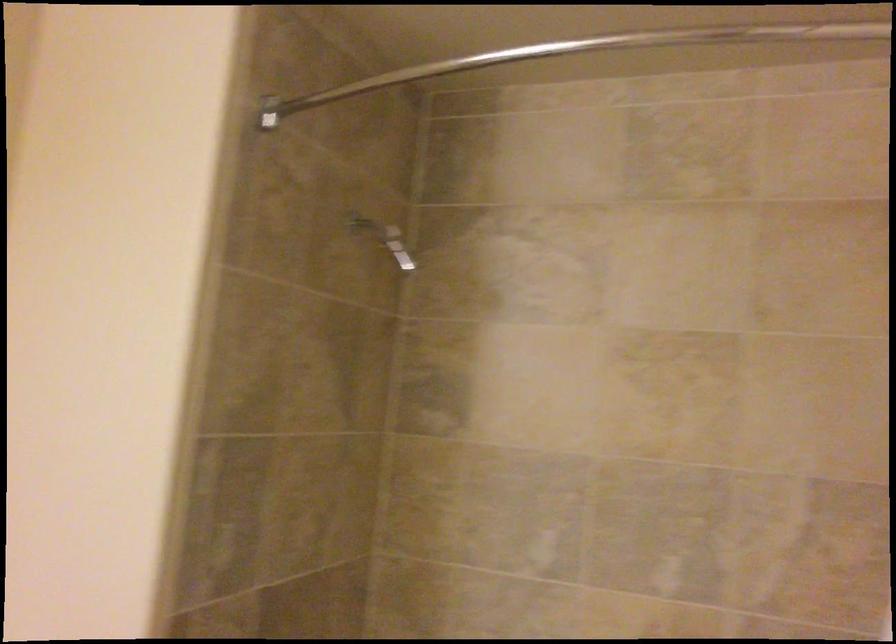
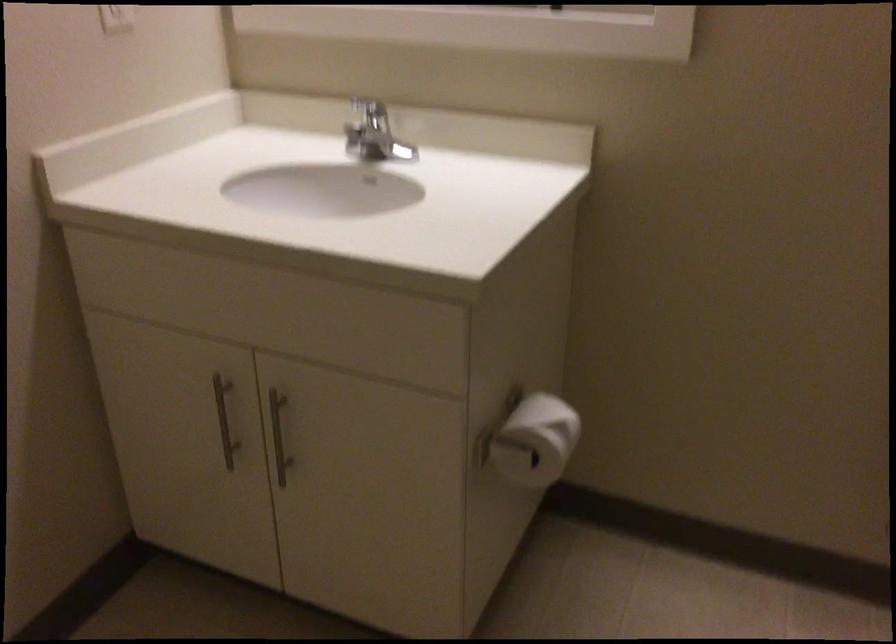
How did the camera likely rotate?

The rotation direction of the camera is left-down.